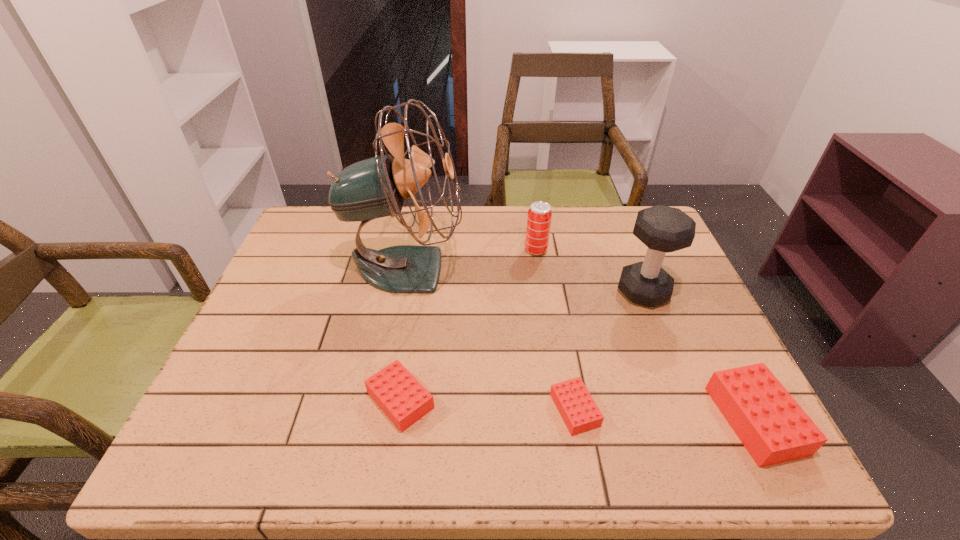
In the image, there is a desktop. At what (x,y) coordinates should I click in order to perform the action: click on vacant space at the far edge. Please return your answer as a coordinate pair (x, y). The width and height of the screenshot is (960, 540). Looking at the image, I should click on (582, 226).

Locate an element on the screen. The height and width of the screenshot is (540, 960). free space at the near edge of the desktop is located at coordinates (602, 386).

In the image, there is a desktop. Where is `vacant space at the left edge`? Image resolution: width=960 pixels, height=540 pixels. vacant space at the left edge is located at coordinates (264, 328).

In the image, there is a desktop. Identify the location of vacant space at the right edge. (669, 305).

This screenshot has width=960, height=540. Identify the location of blank area at the far left corner. (321, 218).

Find the location of a particular element. The height and width of the screenshot is (540, 960). free space at the near left corner of the desktop is located at coordinates (238, 386).

In the image, there is a desktop. At what (x,y) coordinates should I click in order to perform the action: click on vacant space at the far right corner. Please return your answer as a coordinate pair (x, y). Looking at the image, I should click on (612, 221).

Where is `vacant area at the near right corner of the desktop`? The height and width of the screenshot is (540, 960). vacant area at the near right corner of the desktop is located at coordinates (724, 420).

You are a GUI agent. You are given a task and a screenshot of the screen. Output one action in this format:
    pyautogui.click(x=<x>, y=<y>)
    Task: Click on the free space between the rightmost Lego and the shortest object
    
    Given the screenshot: What is the action you would take?
    pyautogui.click(x=665, y=415)

Locate an element on the screen. The height and width of the screenshot is (540, 960). free space between the fifth shortest object and the third shortest object is located at coordinates (699, 356).